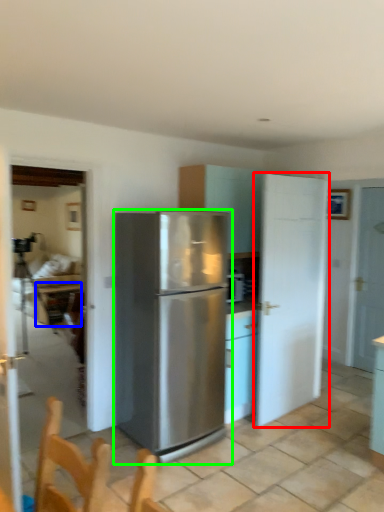
Question: Estimate the real-world distances between objects in this image. Which object is closer to door (highlighted by a red box), table (highlighted by a blue box) or refrigerator (highlighted by a green box)?

Choices:
 (A) table
 (B) refrigerator

Answer: (B)